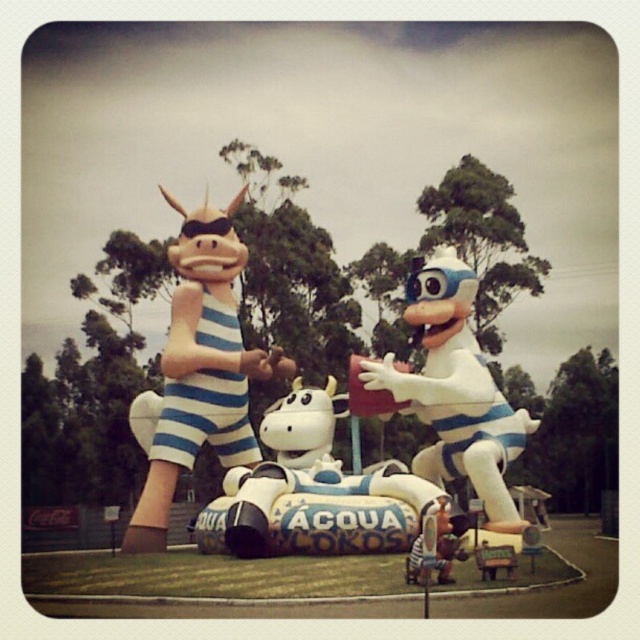
Question: Is white rubber car at center above white glossy toy at center?

Choices:
 (A) no
 (B) yes

Answer: (A)

Question: Estimate the real-world distances between objects in this image. Which object is farther from the white rubber car at center?

Choices:
 (A) white glossy toy at center
 (B) matte plastic pig at center

Answer: (B)

Question: Observing the image, what is the correct spatial positioning of matte plastic pig at center in reference to white rubber car at center?

Choices:
 (A) left
 (B) right

Answer: (A)

Question: Which object is positioned closest to the white rubber car at center?

Choices:
 (A) matte plastic pig at center
 (B) white glossy toy at center

Answer: (B)

Question: Is white rubber car at center wider than white glossy toy at center?

Choices:
 (A) no
 (B) yes

Answer: (B)

Question: Which point appears farthest from the camera in this image?

Choices:
 (A) (205, 220)
 (B) (496, 508)

Answer: (A)